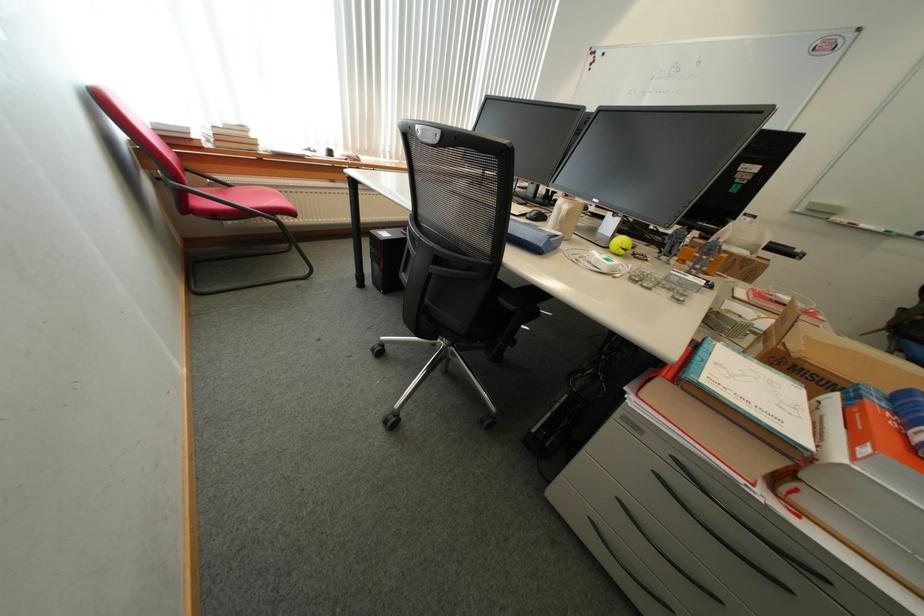
You are a GUI agent. You are given a task and a screenshot of the screen. Output one action in this format:
    pyautogui.click(x=<x>, y=<y>)
    Task: Click on the black chair armrest
    The image size is (924, 616).
    Given the screenshot: What is the action you would take?
    pyautogui.click(x=504, y=310)